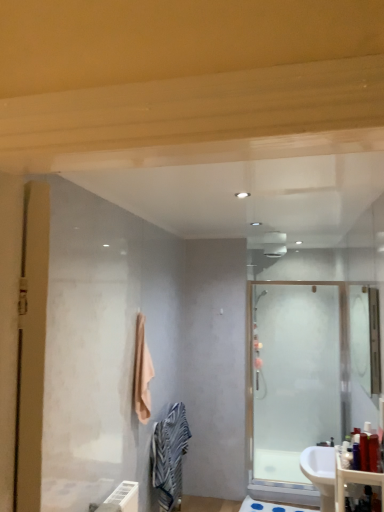
Question: Is white glossy sink at lower right to the left or to the right of clear glass mirror at upper right in the image?

Choices:
 (A) right
 (B) left

Answer: (B)

Question: From a real-world perspective, is white glossy sink at lower right above or below clear glass mirror at upper right?

Choices:
 (A) above
 (B) below

Answer: (B)

Question: Estimate the real-world distances between objects in this image. Which object is farther from the striped cotton bath towel at lower center, marked as the 1th bath towel in a bottom-to-top arrangement?

Choices:
 (A) translucent plastic bottle at right, which ranks as the 2th toiletry in right-to-left order
 (B) matte plastic counter top at lower right
 (C) blue rubber bath mat at lower center
 (D) translucent plastic bottle at lower right, the fourth toiletry from the left
 (E) white glossy sink at lower right

Answer: (D)

Question: Which of these objects is positioned closest to the translucent plastic bottle at right, the 2th toiletry positioned from the left?

Choices:
 (A) clear glass mirror at upper right
 (B) translucent plastic bottle at right, which ranks as the 2th toiletry in right-to-left order
 (C) frosted glass shower door at right
 (D) matte plastic counter top at lower right
 (E) translucent plastic bottle at lower right, the fourth toiletry from the left

Answer: (B)